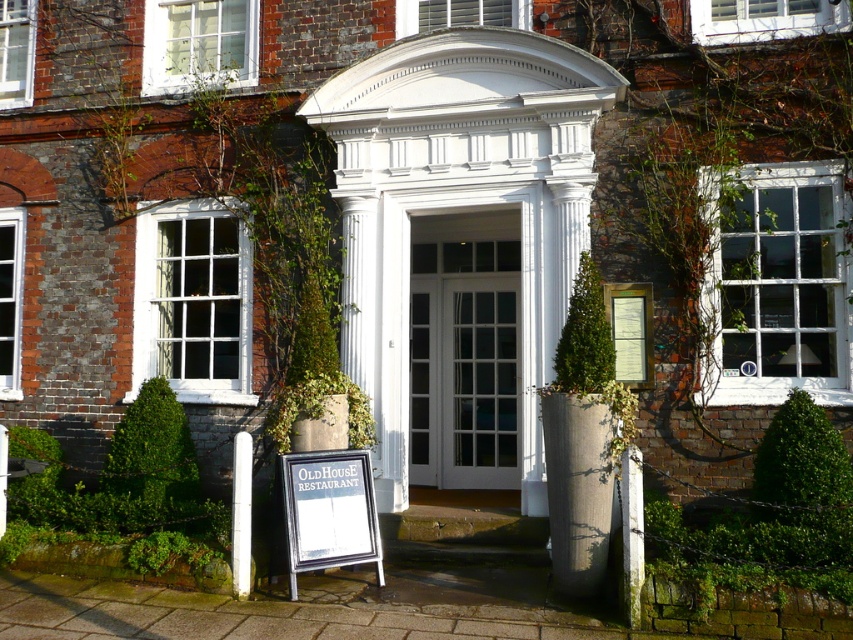
Is white glass door at center to the right of white smooth pillar at lower left from the viewer's perspective?

Indeed, white glass door at center is positioned on the right side of white smooth pillar at lower left.

Is white glass door at center taller than white smooth pillar at lower left?

Correct, white glass door at center is much taller as white smooth pillar at lower left.

The width and height of the screenshot is (853, 640). Describe the element at coordinates (463, 349) in the screenshot. I see `white glass door at center` at that location.

I want to click on white glass door at center, so click(x=463, y=349).

Is white wooden sign at lower left positioned before white smooth pillar at lower left?

Yes, it is in front of white smooth pillar at lower left.

Does point (300, 522) come farther from viewer compared to point (245, 534)?

That is True.

I want to click on white wooden sign at lower left, so (x=329, y=512).

Looking at this image, can you confirm if white glass door at center is positioned to the right of white wooden sign at lower left?

Indeed, white glass door at center is positioned on the right side of white wooden sign at lower left.

Who is more distant from viewer, (415, 484) or (316, 502)?

Point (415, 484)

You are a GUI agent. You are given a task and a screenshot of the screen. Output one action in this format:
    pyautogui.click(x=<x>, y=<y>)
    Task: Click on the white glass door at center
    This screenshot has height=640, width=853.
    Given the screenshot: What is the action you would take?
    click(463, 349)